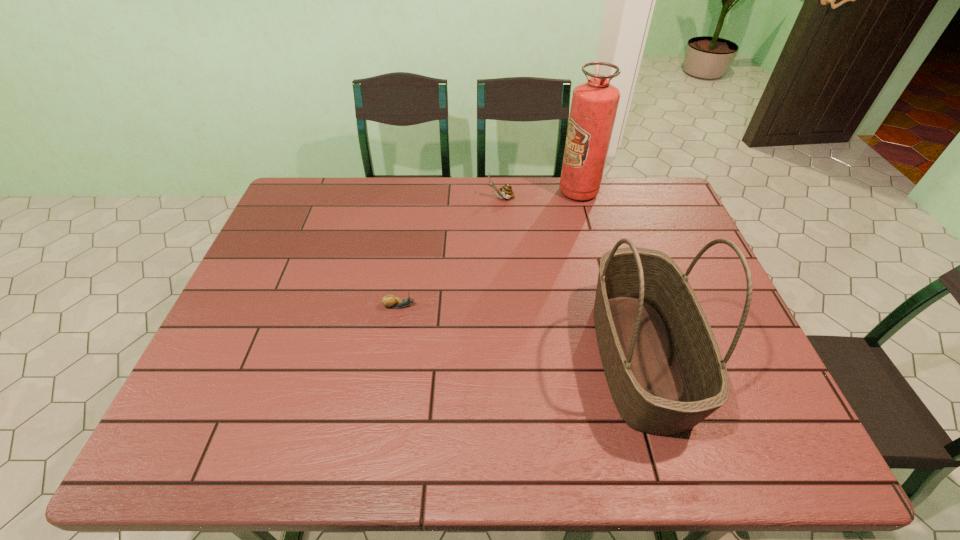
The height and width of the screenshot is (540, 960). I want to click on free point at the near edge, so click(x=690, y=430).

Identify the location of vacant space at the left edge of the desktop. The height and width of the screenshot is (540, 960). (288, 225).

In the image, there is a desktop. Where is `free space at the right edge`? The width and height of the screenshot is (960, 540). free space at the right edge is located at coordinates (759, 404).

At what (x,y) coordinates should I click in order to perform the action: click on free space at the near left corner. Please return your answer as a coordinate pair (x, y). This screenshot has width=960, height=540. Looking at the image, I should click on (229, 446).

Image resolution: width=960 pixels, height=540 pixels. In order to click on vacant region at the far right corner in this screenshot , I will do `click(648, 187)`.

Find the location of a particular element. The height and width of the screenshot is (540, 960). free spot at the near right corner of the desktop is located at coordinates (724, 430).

The width and height of the screenshot is (960, 540). I want to click on empty space between the taller escargot and the tallest object, so click(x=540, y=195).

Find the location of a particular element. Image resolution: width=960 pixels, height=540 pixels. empty space between the second tallest object and the farther escargot is located at coordinates (570, 277).

Find the location of a particular element. free space between the basket and the shorter escargot is located at coordinates (519, 331).

Where is `free area in between the basket and the left escargot`? free area in between the basket and the left escargot is located at coordinates (519, 331).